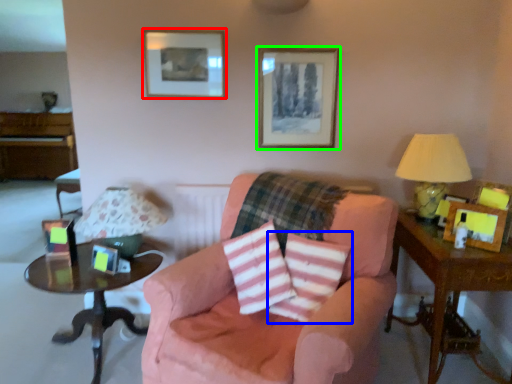
Question: Which object is positioned closest to picture frame (highlighted by a red box)? Select from throw pillow (highlighted by a blue box) and picture frame (highlighted by a green box).

Choices:
 (A) throw pillow
 (B) picture frame

Answer: (B)